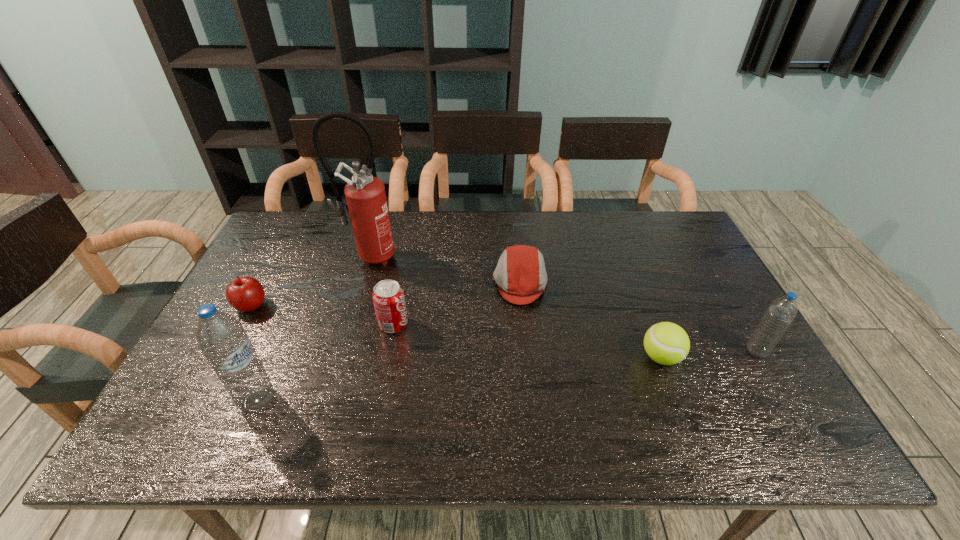
You are a GUI agent. You are given a task and a screenshot of the screen. Output one action in this format:
    pyautogui.click(x=<x>, y=<y>)
    Task: Click on the sixth object from right to left
    
    Given the screenshot: What is the action you would take?
    pyautogui.click(x=221, y=337)

The height and width of the screenshot is (540, 960). In order to click on the sixth shortest object in this screenshot , I will do `click(221, 337)`.

Locate an element on the screen. the rightmost object is located at coordinates (781, 312).

The height and width of the screenshot is (540, 960). In order to click on the fifth shortest object in this screenshot , I will do `click(781, 312)`.

In order to click on the tallest object in this screenshot , I will do `click(365, 194)`.

Where is `soda`? soda is located at coordinates (388, 297).

This screenshot has height=540, width=960. I want to click on apple, so click(246, 294).

The height and width of the screenshot is (540, 960). What are the coordinates of `tennis ball` in the screenshot? It's located at (666, 343).

Where is `cap`? This screenshot has width=960, height=540. cap is located at coordinates pos(520,274).

In order to click on vacant space situated on the right of the nearest object in this screenshot , I will do `click(450, 400)`.